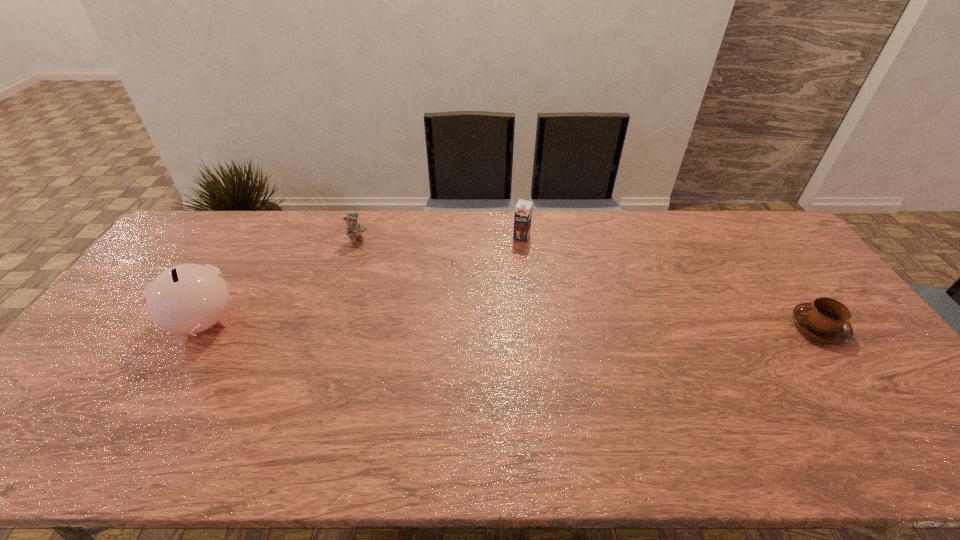
What are the coordinates of `object at the right edge` in the screenshot? It's located at (826, 319).

Where is `free location at the far edge of the desktop`? The height and width of the screenshot is (540, 960). free location at the far edge of the desktop is located at coordinates (387, 237).

The height and width of the screenshot is (540, 960). Find the location of `vacant space at the left edge of the desktop`. vacant space at the left edge of the desktop is located at coordinates (108, 336).

I want to click on vacant space at the right edge of the desktop, so click(821, 291).

What are the coordinates of `free location at the far right corner of the desktop` in the screenshot? It's located at (740, 212).

Identify the location of unoccupied position between the cappuccino and the third tallest object. This screenshot has height=540, width=960. (588, 285).

Locate an element on the screen. This screenshot has height=540, width=960. free space between the chocolate milk and the shortest object is located at coordinates (670, 282).

The height and width of the screenshot is (540, 960). Identify the location of empty space that is in between the third shortest object and the third tallest object. (440, 240).

You are a GUI agent. You are given a task and a screenshot of the screen. Output one action in this format:
    pyautogui.click(x=<x>, y=<y>)
    Task: Click on the free spot between the teddy bear and the tallest object
    
    Given the screenshot: What is the action you would take?
    pyautogui.click(x=281, y=283)

I want to click on free space between the chocolate milk and the teddy bear, so click(440, 240).